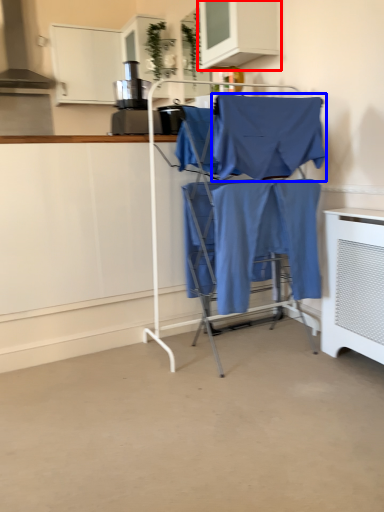
Question: Which point is further to the camera, cabinetry (highlighted by a red box) or fabric (highlighted by a blue box)?

Choices:
 (A) cabinetry
 (B) fabric

Answer: (A)